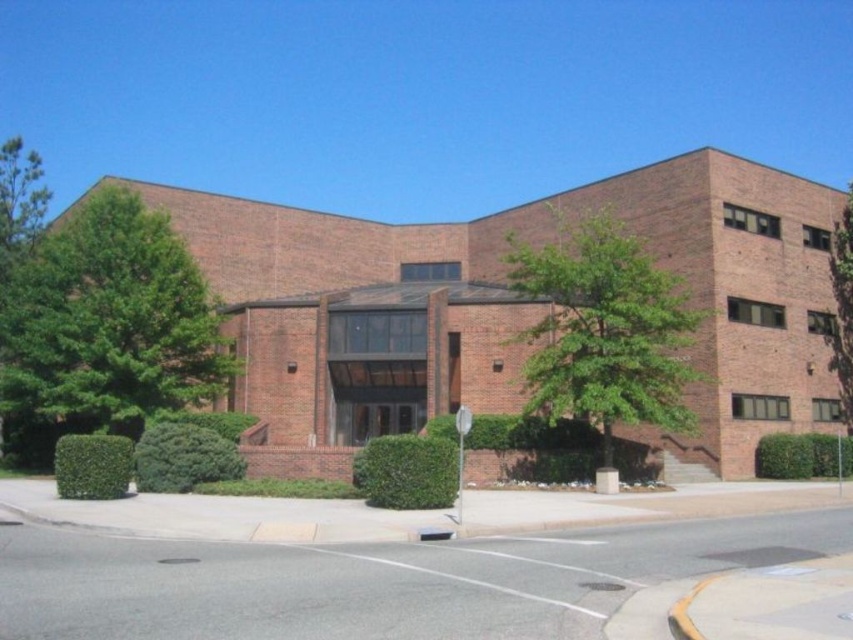
Is green leafy tree at left above green leafy tree at center?

Yes, green leafy tree at left is above green leafy tree at center.

Based on the photo, who is positioned more to the right, green leafy tree at left or green leafy tree at center?

green leafy tree at center is more to the right.

Find the location of a particular element. This screenshot has height=640, width=853. green leafy tree at left is located at coordinates (106, 326).

Find the location of a particular element. Image resolution: width=853 pixels, height=640 pixels. green leafy tree at left is located at coordinates (106, 326).

Is brick building at center to the left of green leafy tree at center from the viewer's perspective?

Yes, brick building at center is to the left of green leafy tree at center.

Is brick building at center above green leafy tree at center?

Correct, brick building at center is located above green leafy tree at center.

Is point (705, 276) positioned in front of point (598, 320)?

No.

The image size is (853, 640). I want to click on brick building at center, so click(x=517, y=305).

Can you confirm if brick building at center is smaller than green leafy tree at right?

Yes.

The width and height of the screenshot is (853, 640). Find the location of `brick building at center`. brick building at center is located at coordinates (517, 305).